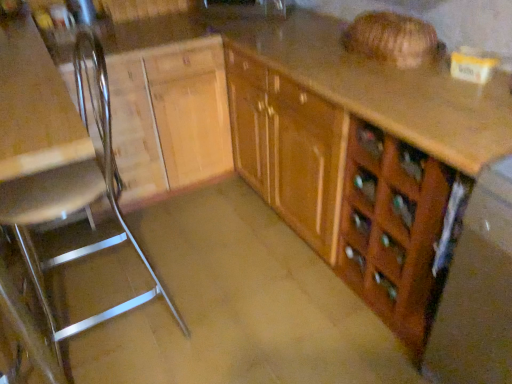
Question: From the image's perspective, is wooden cabinet at center above or below brown matte concrete at center?

Choices:
 (A) above
 (B) below

Answer: (A)

Question: Do you think wooden cabinet at center is within brown matte concrete at center, or outside of it?

Choices:
 (A) inside
 (B) outside

Answer: (B)

Question: Which object is positioned closest to the metallic silver chair at left?

Choices:
 (A) wooden drawer at lower right
 (B) wooden cabinet at center
 (C) brown matte concrete at center
 (D) matte black sink at upper center

Answer: (C)

Question: Which object is positioned closest to the wooden cabinet at center?

Choices:
 (A) brown matte concrete at center
 (B) matte black sink at upper center
 (C) metallic silver chair at left
 (D) wooden drawer at lower right

Answer: (D)